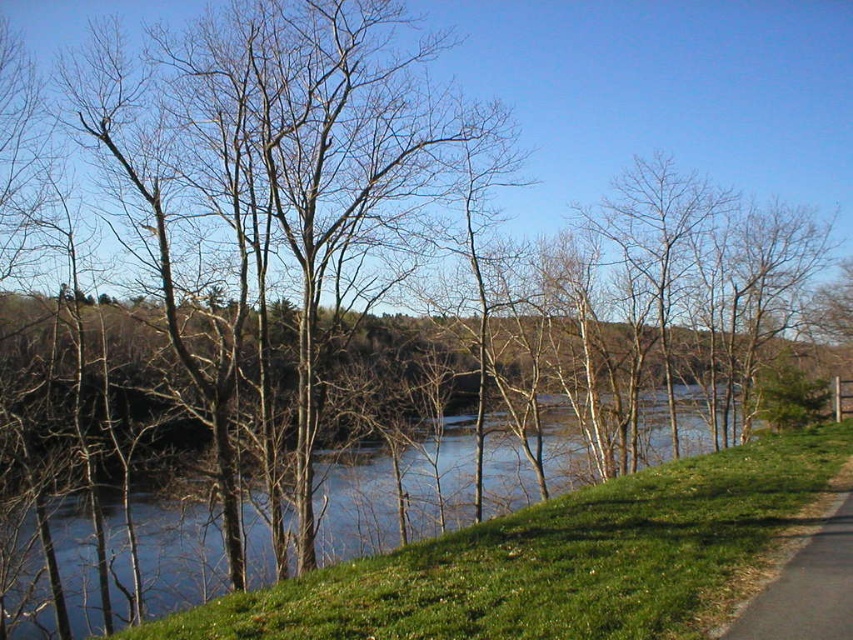
Question: Is blue water at center smaller than black asphalt path at lower right?

Choices:
 (A) yes
 (B) no

Answer: (B)

Question: Is blue water at center bigger than black asphalt path at lower right?

Choices:
 (A) no
 (B) yes

Answer: (B)

Question: Which object appears farthest from the camera in this image?

Choices:
 (A) black asphalt path at lower right
 (B) blue water at center

Answer: (B)

Question: Which point is closer to the camera?

Choices:
 (A) black asphalt path at lower right
 (B) blue water at center

Answer: (A)

Question: Does blue water at center appear on the right side of black asphalt path at lower right?

Choices:
 (A) yes
 (B) no

Answer: (A)